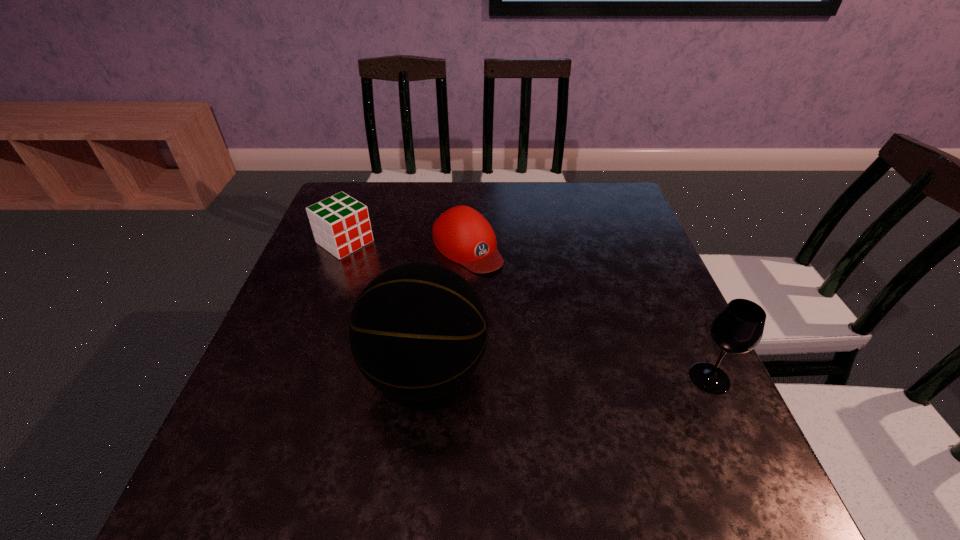
Locate an element on the screen. vacant space on the desktop that is between the tallest object and the wineglass and is positioned on the red face of the leftmost object is located at coordinates (535, 374).

Locate an element on the screen. vacant spot on the desktop that is between the basketball and the wineglass and is positioned on the front-facing side of the baseball cap is located at coordinates (596, 375).